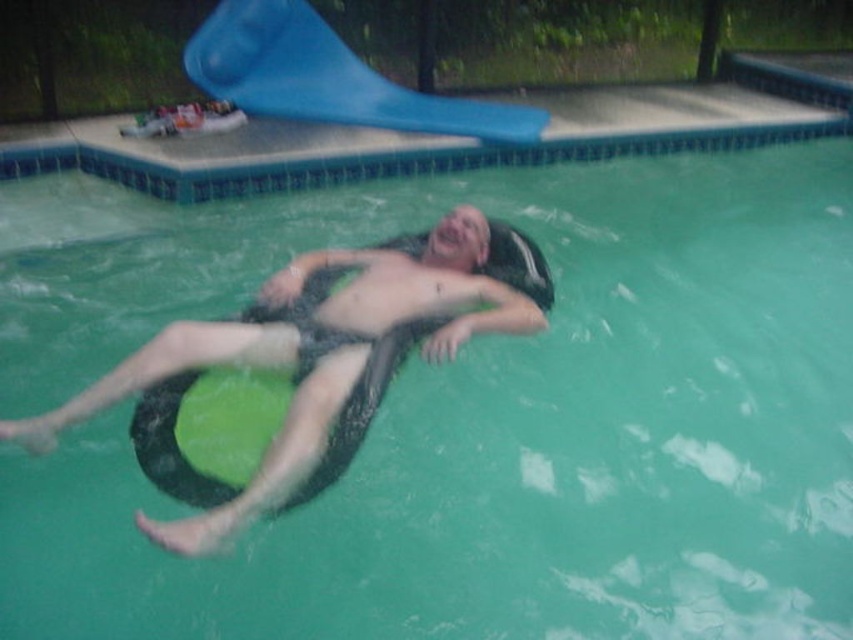
You are a lifeguard at the pool and see the black rubber tube at center and the blue rubber slide at upper center. Which object is closer to you from your observation point?

The black rubber tube at center is closer to you because it is in front of the blue rubber slide at upper center.

You are designing a safety inspection report for the water slide facility. According to the image, which object is taller between the black rubber tube at center and the blue rubber slide at upper center?

The black rubber tube at center is taller than the blue rubber slide at upper center according to the description.

You are standing at the edge of the pool and see the black rubber tube at center floating in the water. If you want to grab it, can you reach it without entering the water? Your arm can extend 1.5 meters.

The black rubber tube at center is 2.68 meters from the viewer. Since your arm can only extend 1.5 meters, you cannot reach it without entering the water.